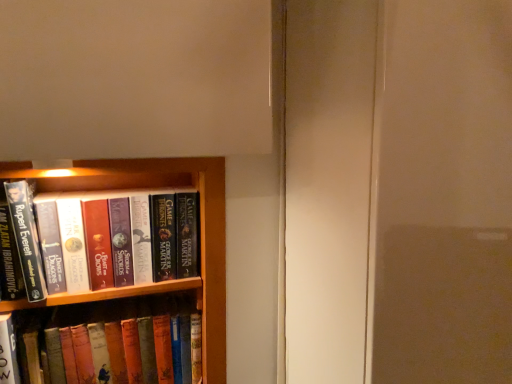
Question: Is point (15, 183) closer or farther from the camera than point (52, 357)?

Choices:
 (A) farther
 (B) closer

Answer: (B)

Question: In terms of width, does hardcover books at left, positioned as the 2th book in bottom-to-top order, look wider or thinner when compared to hardcover book at left, marked as the 1th book in a bottom-to-top arrangement?

Choices:
 (A) wide
 (B) thin

Answer: (A)

Question: From a real-world perspective, is hardcover books at left, the first book when ordered from top to bottom, physically located above or below hardcover book at left, which is counted as the second book, starting from the top?

Choices:
 (A) below
 (B) above

Answer: (B)

Question: Is hardcover book at left, which is counted as the second book, starting from the top, in front of or behind hardcover books at left, the first book when ordered from top to bottom, in the image?

Choices:
 (A) behind
 (B) front

Answer: (A)

Question: Does point [x=178, y=329] appear closer or farther from the camera than point [x=119, y=258]?

Choices:
 (A) farther
 (B) closer

Answer: (A)

Question: From the image's perspective, is hardcover book at left, which is counted as the second book, starting from the top, above or below hardcover books at left, the first book when ordered from top to bottom?

Choices:
 (A) below
 (B) above

Answer: (A)

Question: Is hardcover book at left, which is counted as the second book, starting from the top, bigger or smaller than hardcover books at left, positioned as the 2th book in bottom-to-top order?

Choices:
 (A) small
 (B) big

Answer: (B)